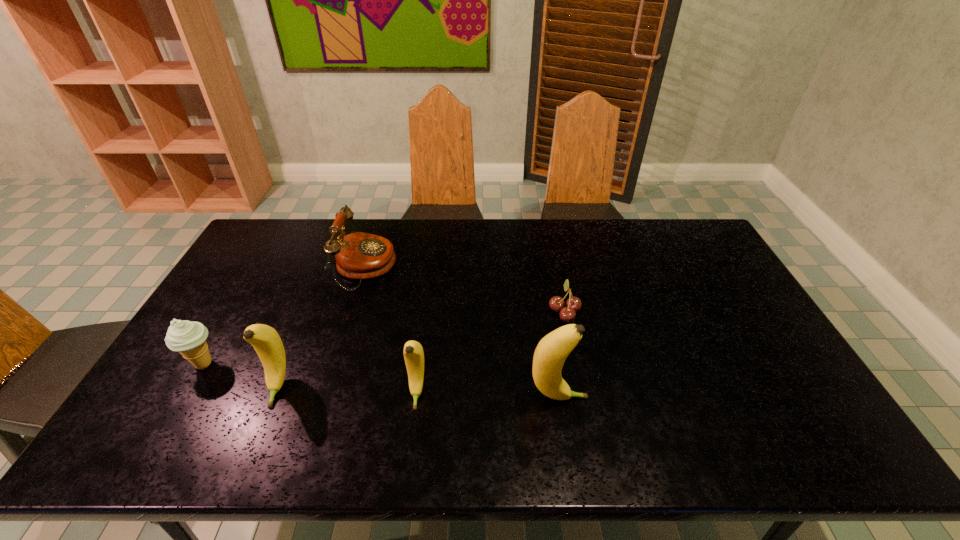
Please point a free position for a banana on the right. Please provide its 2D coordinates. Your answer should be formatted as a tuple, i.e. [(x, y)], where the tuple contains the x and y coordinates of a point satisfying the conditions above.

[(704, 403)]